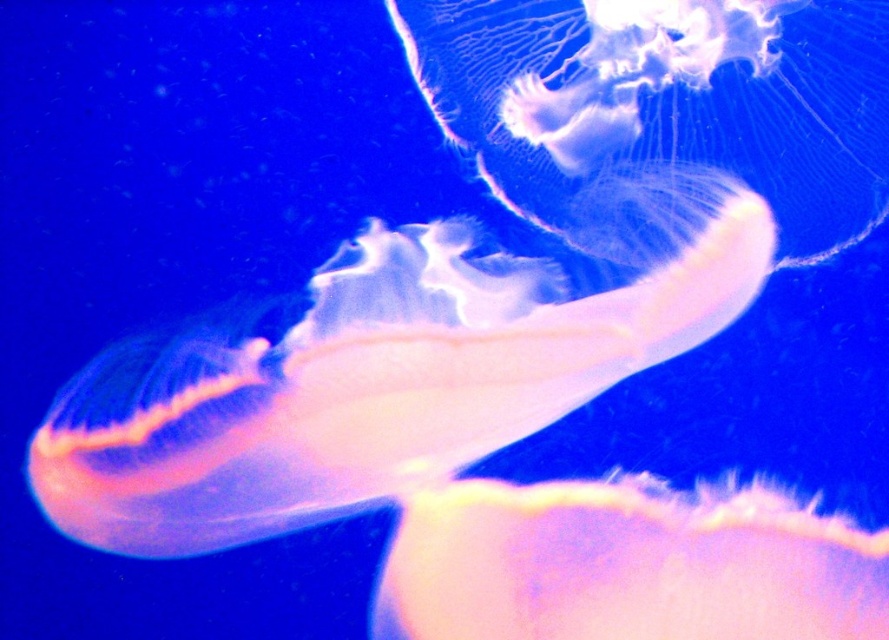
You are a marine biologist observing two jellyfish in an aquarium tank. You notice a translucent white jellyfish at center and a translucent pink jellyfish at center. Which one has a greater height?

The translucent white jellyfish at center is much taller than the translucent pink jellyfish at center.

You are an underwater photographer aiming to capture the translucent white jellyfish at center and the translucent white jellyfish at upper center in a single frame. Based on their sizes, which jellyfish would appear larger in your photo?

The translucent white jellyfish at center would appear larger in the photo since it is wider than the translucent white jellyfish at upper center.